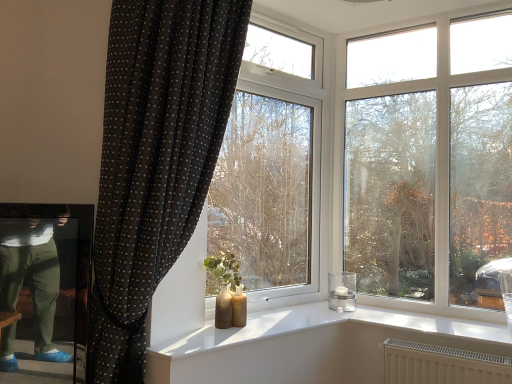
Question: Does transparent glass window at center appear on the right side of transparent glass tree at center?

Choices:
 (A) no
 (B) yes

Answer: (A)

Question: Does transparent glass window at center have a lesser width compared to transparent glass tree at center?

Choices:
 (A) yes
 (B) no

Answer: (B)

Question: Is transparent glass window at center shorter than transparent glass tree at center?

Choices:
 (A) no
 (B) yes

Answer: (A)

Question: Is transparent glass window at center positioned far away from transparent glass tree at center?

Choices:
 (A) no
 (B) yes

Answer: (A)

Question: Does transparent glass window at center touch transparent glass tree at center?

Choices:
 (A) yes
 (B) no

Answer: (B)

Question: Is transparent glass window at center wider than transparent glass tree at center?

Choices:
 (A) yes
 (B) no

Answer: (A)

Question: From a real-world perspective, does transparent glass tree at center stand above transparent glass window at center?

Choices:
 (A) yes
 (B) no

Answer: (A)

Question: Is there a large distance between transparent glass tree at center and transparent glass window at center?

Choices:
 (A) no
 (B) yes

Answer: (A)

Question: Is transparent glass tree at center at the left side of transparent glass window at center?

Choices:
 (A) no
 (B) yes

Answer: (A)

Question: Is transparent glass tree at center positioned beyond the bounds of transparent glass window at center?

Choices:
 (A) yes
 (B) no

Answer: (A)

Question: Considering the relative sizes of transparent glass tree at center and transparent glass window at center in the image provided, is transparent glass tree at center taller than transparent glass window at center?

Choices:
 (A) no
 (B) yes

Answer: (A)

Question: Is transparent glass tree at center positioned in front of transparent glass window at center?

Choices:
 (A) no
 (B) yes

Answer: (A)

Question: From the image's perspective, does transparent glass tree at center appear lower than black dotted fabric curtain at left?

Choices:
 (A) no
 (B) yes

Answer: (A)